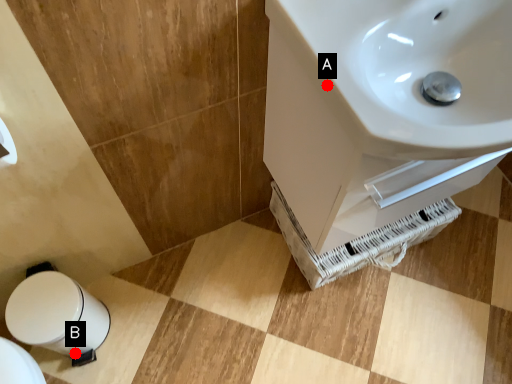
Question: Two points are circled on the image, labeled by A and B beside each circle. Which point is further to the camera?

Choices:
 (A) A is further
 (B) B is further

Answer: (B)